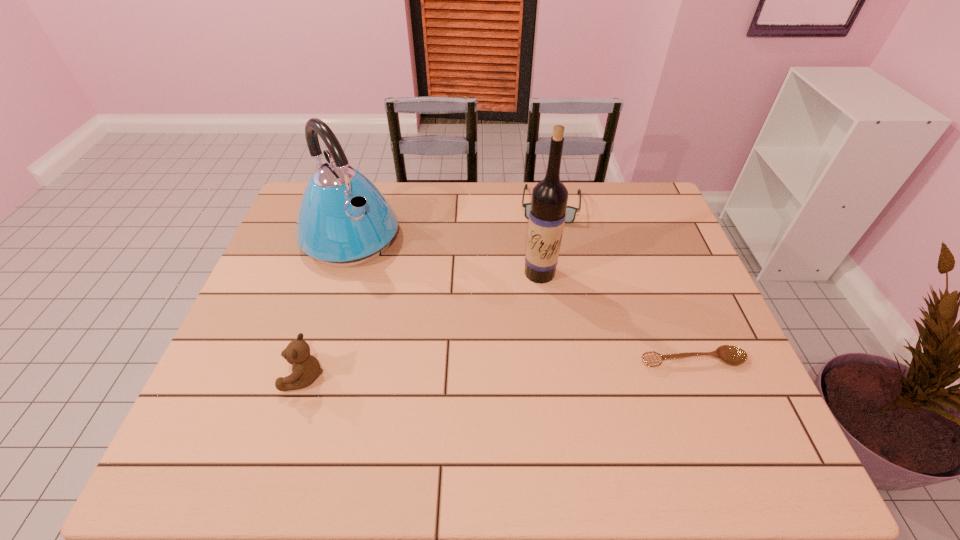
Identify the location of teddy bear. (306, 368).

Where is `the rightmost object`? This screenshot has height=540, width=960. the rightmost object is located at coordinates (732, 355).

You are a GUI agent. You are given a task and a screenshot of the screen. Output one action in this format:
    pyautogui.click(x=<x>, y=<y>)
    Task: Click on the shortest object
    Image resolution: width=960 pixels, height=540 pixels.
    Given the screenshot: What is the action you would take?
    [x=732, y=355]

Locate an element on the screen. Image resolution: width=960 pixels, height=540 pixels. kettle is located at coordinates (343, 220).

The width and height of the screenshot is (960, 540). In order to click on spectacles in this screenshot , I will do `click(571, 211)`.

At what (x,y) coordinates should I click in order to perform the action: click on wine bottle. Please return your answer as a coordinate pair (x, y). Image resolution: width=960 pixels, height=540 pixels. Looking at the image, I should click on (549, 200).

Image resolution: width=960 pixels, height=540 pixels. In order to click on free location located 0.060m on the front-facing side of the third tallest object in this screenshot , I will do `click(259, 375)`.

Where is `vacant space located on the front-facing side of the third tallest object`? vacant space located on the front-facing side of the third tallest object is located at coordinates 254,375.

At what (x,y) coordinates should I click in order to perform the action: click on vacant space situated 0.050m on the left of the shortest object. Please return your answer as a coordinate pair (x, y). The height and width of the screenshot is (540, 960). Looking at the image, I should click on (619, 360).

The image size is (960, 540). I want to click on free space located at the spout of the second tallest object, so click(419, 312).